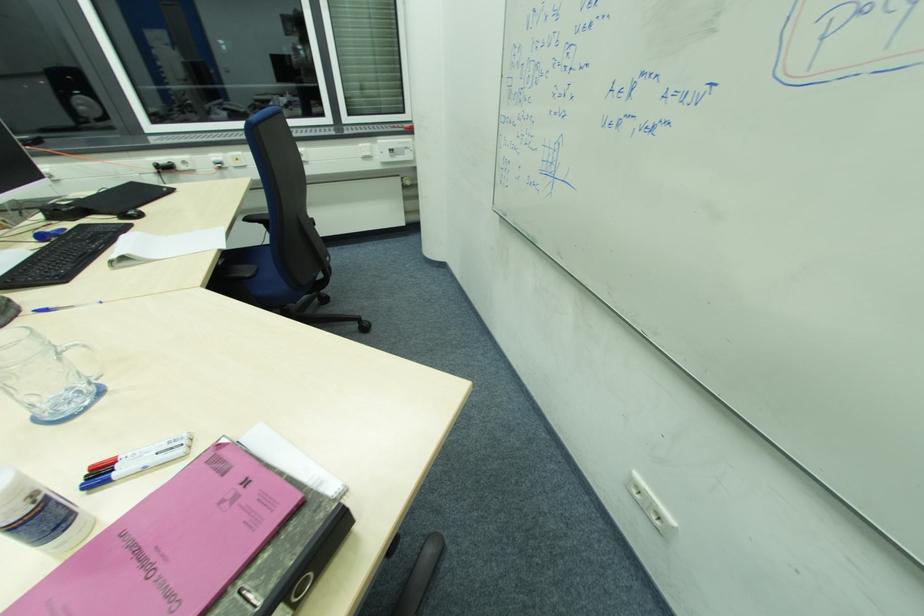
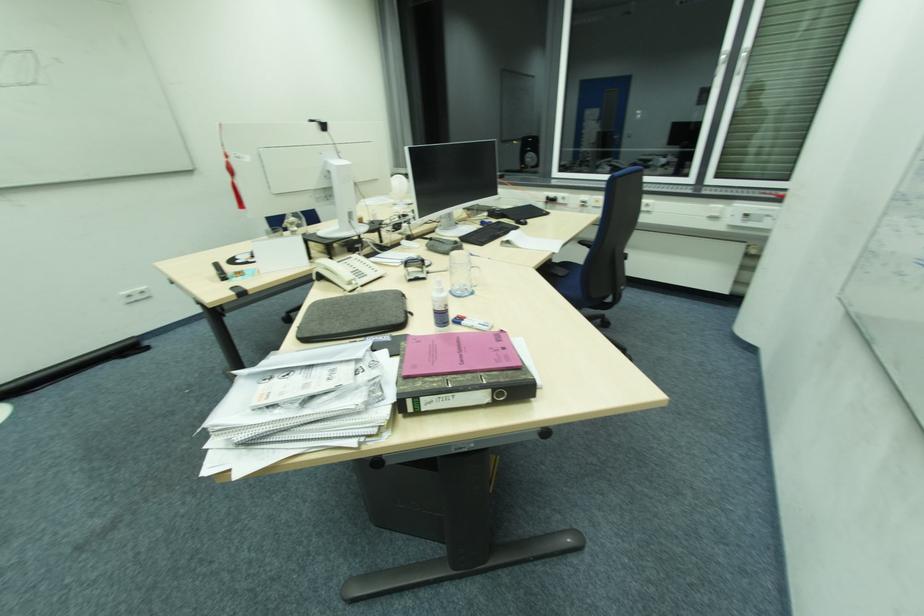
Locate, in the second image, the point that corresponds to point (164, 585) in the first image.

(465, 357)